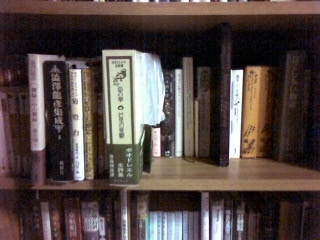
Identify the location of sixth book from top of bookcase on the left. This screenshot has height=240, width=320. (154, 85).